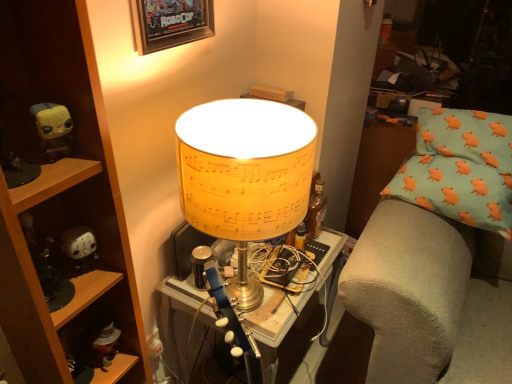
In order to click on wooden framed poster at upper center in this screenshot , I will do `click(170, 23)`.

In order to face matte yellow lampshade at center, should I rotate leftwards or rightwards?

You should rotate right by 1.306 degrees.

Locate an element on the screen. wooden framed poster at upper center is located at coordinates (170, 23).

In the scene shown: From the image's perspective, is wooden shelf at left located above or below yellow matte toy at left, which is the 1th toy from front to back?

Based on their image positions, wooden shelf at left is located beneath yellow matte toy at left, which is the 1th toy from front to back.

Is wooden shelf at left not inside yellow matte toy at left, which is counted as the 2th toy, starting from the bottom?

Yes, wooden shelf at left is outside of yellow matte toy at left, which is counted as the 2th toy, starting from the bottom.

Which is in front, point (22, 286) or point (45, 131)?

The point (22, 286) is in front.

Who is bigger, wooden shelf at left or yellow matte toy at left, positioned as the first toy in top-to-bottom order?

Bigger between the two is wooden shelf at left.

Considering the positions of objects wooden framed poster at upper center and black matte jason voorhees mask at left, the 2th toy viewed from the top, in the image provided, who is more to the right, wooden framed poster at upper center or black matte jason voorhees mask at left, the 2th toy viewed from the top,?

wooden framed poster at upper center.

Between wooden framed poster at upper center and black matte jason voorhees mask at left, the second toy from the front, which one has larger width?

Wider between the two is black matte jason voorhees mask at left, the second toy from the front.

Is wooden framed poster at upper center not near black matte jason voorhees mask at left, the second toy from the front?

No, wooden framed poster at upper center is not far away from black matte jason voorhees mask at left, the second toy from the front.

From a real-world perspective, does wooden framed poster at upper center stand above black matte jason voorhees mask at left, the second toy from the front?

Yes, from a real-world perspective, wooden framed poster at upper center is over black matte jason voorhees mask at left, the second toy from the front

Is wooden shelf at left facing away from black matte jason voorhees mask at left, the 1th toy when ordered from bottom to top?

Correct, wooden shelf at left is looking away from black matte jason voorhees mask at left, the 1th toy when ordered from bottom to top.

Measure the distance from wooden shelf at left to black matte jason voorhees mask at left, the 2th toy viewed from the top.

wooden shelf at left and black matte jason voorhees mask at left, the 2th toy viewed from the top, are 6.38 inches apart.

Consider the image. Considering the sizes of wooden shelf at left and black matte jason voorhees mask at left, the first toy when ordered from back to front, in the image, is wooden shelf at left wider or thinner than black matte jason voorhees mask at left, the first toy when ordered from back to front,?

Clearly, wooden shelf at left has more width compared to black matte jason voorhees mask at left, the first toy when ordered from back to front.

Considering the relative sizes of matte yellow lampshade at center and wooden shelf at left in the image provided, is matte yellow lampshade at center bigger than wooden shelf at left?

Actually, matte yellow lampshade at center might be smaller than wooden shelf at left.

Is matte yellow lampshade at center at the right side of wooden shelf at left?

Yes.

From a real-world perspective, is matte yellow lampshade at center physically above wooden shelf at left?

Incorrect, from a real-world perspective, matte yellow lampshade at center is lower than wooden shelf at left.

Is matte yellow lampshade at center positioned with its back to wooden shelf at left?

Yes, matte yellow lampshade at center is positioned with its back facing wooden shelf at left.

Could you tell me if black matte jason voorhees mask at left, the first toy when ordered from back to front, is turned towards matte yellow lampshade at center?

Yes, black matte jason voorhees mask at left, the first toy when ordered from back to front, is oriented towards matte yellow lampshade at center.

Between point (88, 232) and point (212, 244), which one is positioned in front?

The point (88, 232) is closer to the camera.

Based on the photo, is black matte jason voorhees mask at left, the 1th toy when ordered from bottom to top, inside the boundaries of matte yellow lampshade at center, or outside?

black matte jason voorhees mask at left, the 1th toy when ordered from bottom to top, exists outside the volume of matte yellow lampshade at center.

Between black matte jason voorhees mask at left, the 2th toy viewed from the top, and matte yellow lampshade at center, which one has smaller width?

black matte jason voorhees mask at left, the 2th toy viewed from the top, is thinner.

Considering the relative sizes of wooden shelf at left and matte yellow lampshade at center in the image provided, is wooden shelf at left thinner than matte yellow lampshade at center?

Correct, the width of wooden shelf at left is less than that of matte yellow lampshade at center.

Based on the photo, between wooden shelf at left and matte yellow lampshade at center, which one is positioned in front?

matte yellow lampshade at center.

From the image's perspective, which is above, wooden shelf at left or matte yellow lampshade at center?

From the image's view, wooden shelf at left is above.

From a real-world perspective, between wooden framed poster at upper center and matte yellow lampshade at center, who is vertically lower?

In real-world perspective, matte yellow lampshade at center is lower.

Measure the distance from wooden framed poster at upper center to matte yellow lampshade at center.

wooden framed poster at upper center is 25.84 inches away from matte yellow lampshade at center.

Considering the relative sizes of wooden framed poster at upper center and matte yellow lampshade at center in the image provided, is wooden framed poster at upper center wider than matte yellow lampshade at center?

Incorrect, the width of wooden framed poster at upper center does not surpass that of matte yellow lampshade at center.

Is wooden framed poster at upper center to the right of matte yellow lampshade at center from the viewer's perspective?

No.

At what (x,y) coordinates should I click in order to perform the action: click on furniture below the yellow matte toy at left, positioned as the first toy in top-to-bottom order (from a real-world perspective). Please return your answer as a coordinate pair (x, y). This screenshot has width=512, height=384. Looking at the image, I should click on (62, 203).

Identify the location of toy located behind the wooden framed poster at upper center. This screenshot has height=384, width=512. click(80, 248).

Based on their spatial positions, is matte yellow lampshade at center or wooden shelf at left closer to yellow matte toy at left, which is the 2th toy from back to front?

Among the two, wooden shelf at left is located nearer to yellow matte toy at left, which is the 2th toy from back to front.

Based on their spatial positions, is wooden framed poster at upper center or black matte jason voorhees mask at left, the 2th toy viewed from the top, closer to wooden shelf at left?

Among the two, black matte jason voorhees mask at left, the 2th toy viewed from the top, is located nearer to wooden shelf at left.

Looking at the image, which one is located closer to yellow matte toy at left, which is counted as the 2th toy, starting from the bottom, black matte jason voorhees mask at left, the 1th toy when ordered from bottom to top, or wooden shelf at left?

The object closer to yellow matte toy at left, which is counted as the 2th toy, starting from the bottom, is black matte jason voorhees mask at left, the 1th toy when ordered from bottom to top.

Estimate the real-world distances between objects in this image. Which object is closer to yellow matte toy at left, positioned as the first toy in top-to-bottom order, black matte jason voorhees mask at left, the 1th toy when ordered from bottom to top, or wooden framed poster at upper center?

black matte jason voorhees mask at left, the 1th toy when ordered from bottom to top, lies closer to yellow matte toy at left, positioned as the first toy in top-to-bottom order, than the other object.

Looking at the image, which one is located closer to black matte jason voorhees mask at left, the 1th toy when ordered from bottom to top, matte yellow lampshade at center or yellow matte toy at left, which is the 1th toy from front to back?

yellow matte toy at left, which is the 1th toy from front to back, lies closer to black matte jason voorhees mask at left, the 1th toy when ordered from bottom to top, than the other object.

Considering their positions, is black matte jason voorhees mask at left, the first toy when ordered from back to front, positioned closer to matte yellow lampshade at center than wooden framed poster at upper center?

black matte jason voorhees mask at left, the first toy when ordered from back to front, lies closer to matte yellow lampshade at center than the other object.

When comparing their distances from yellow matte toy at left, which is the 2th toy from back to front, does wooden shelf at left or wooden framed poster at upper center seem further?

wooden framed poster at upper center.

From the image, which object appears to be farther from wooden shelf at left, wooden framed poster at upper center or matte yellow lampshade at center?

Based on the image, wooden framed poster at upper center appears to be further to wooden shelf at left.

The image size is (512, 384). What are the coordinates of `furniture between wooden framed poster at upper center and matte yellow lampshade at center in the up-down direction` in the screenshot? It's located at (62, 203).

Find the location of `toy between yellow matte toy at left, positioned as the first toy in top-to-bottom order, and matte yellow lampshade at center from top to bottom`. toy between yellow matte toy at left, positioned as the first toy in top-to-bottom order, and matte yellow lampshade at center from top to bottom is located at coordinates (80, 248).

Where is `toy between wooden shelf at left and black matte jason voorhees mask at left, the first toy when ordered from back to front, from front to back`? The height and width of the screenshot is (384, 512). toy between wooden shelf at left and black matte jason voorhees mask at left, the first toy when ordered from back to front, from front to back is located at coordinates (53, 129).

Identify the location of toy between wooden framed poster at upper center and black matte jason voorhees mask at left, the first toy when ordered from back to front, in the vertical direction. (53, 129).